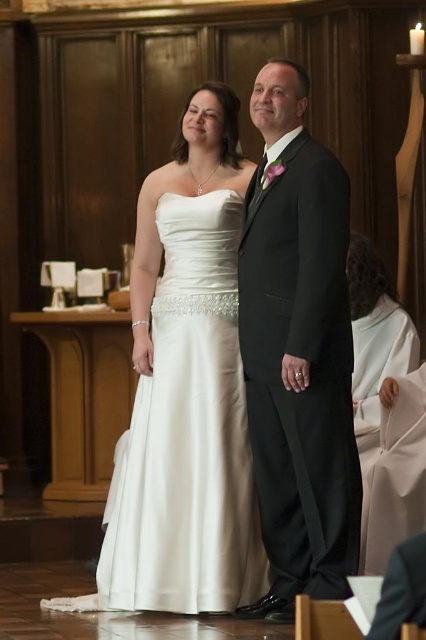
Question: Can you confirm if white satin dress at center is thinner than black satin suit at center?

Choices:
 (A) yes
 (B) no

Answer: (B)

Question: Is white satin dress at center smaller than black satin suit at center?

Choices:
 (A) no
 (B) yes

Answer: (B)

Question: Observing the image, what is the correct spatial positioning of white satin dress at center in reference to black satin suit at center?

Choices:
 (A) right
 (B) left

Answer: (B)